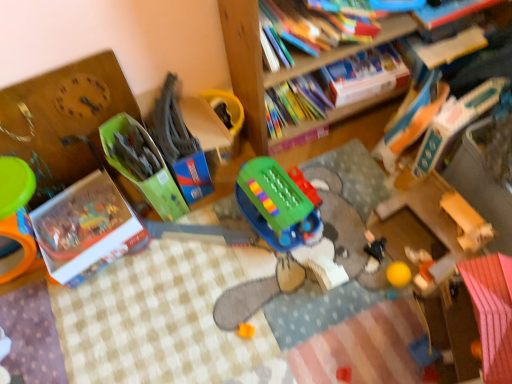
At what (x,y) coordinates should I click in order to perform the action: click on free space on the front side of orange matte cube at center, the 4th toy viewed from the right. Please return your answer as a coordinate pair (x, y). This screenshot has height=384, width=512. Looking at the image, I should click on (251, 364).